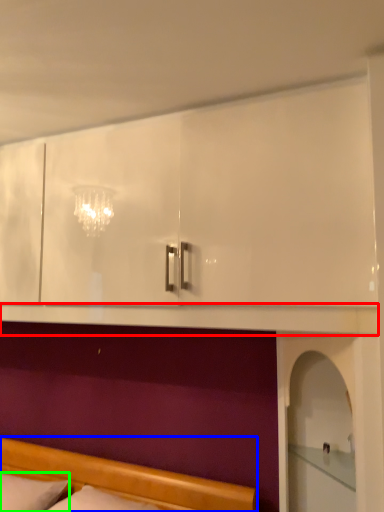
Question: Estimate the real-world distances between objects in this image. Which object is farther from mantle (highlighted by a red box), bed (highlighted by a blue box) or pillow (highlighted by a green box)?

Choices:
 (A) bed
 (B) pillow

Answer: (B)